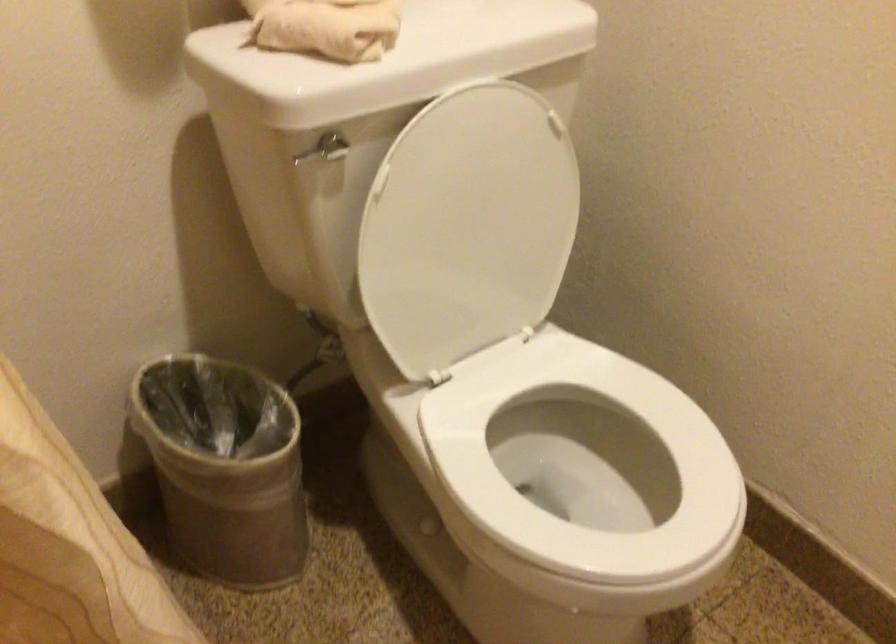
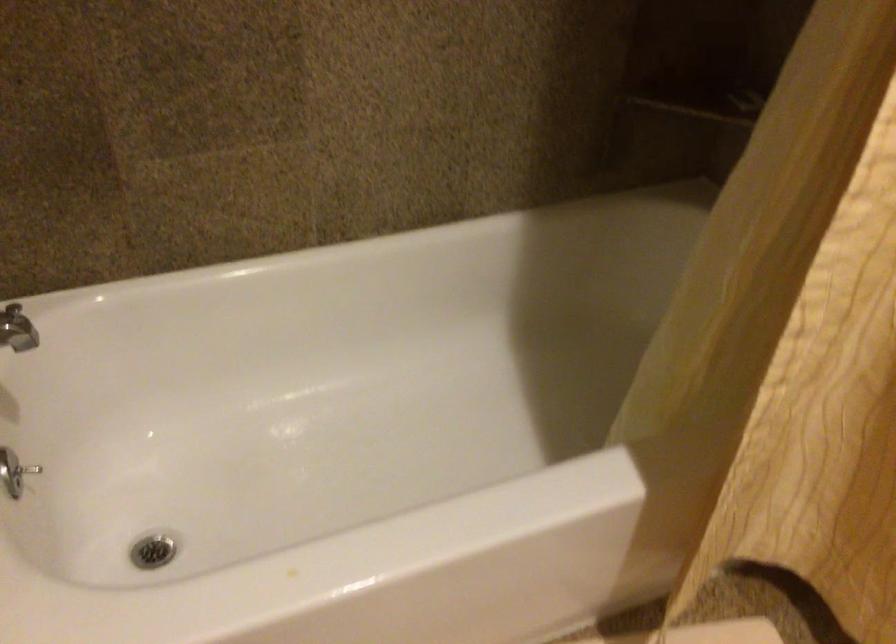
How did the camera likely rotate?

The rotation direction of the camera is left-down.